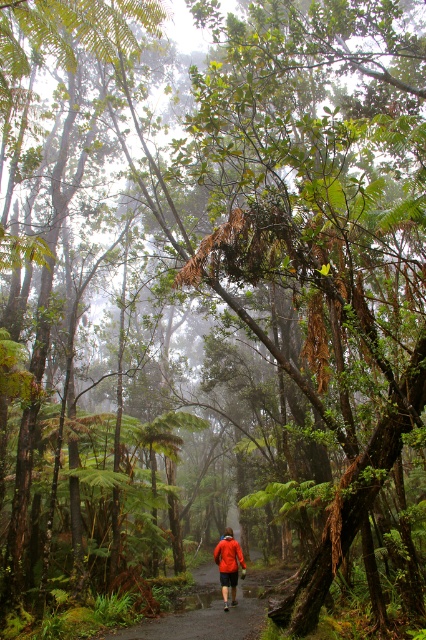
Who is taller, dark brown dirt path at center or red fabric jacket at center?

With more height is dark brown dirt path at center.

Between point (256, 589) and point (226, 572), which one is positioned in front?

Point (226, 572) is more forward.

Where is `dark brown dirt path at center`? The image size is (426, 640). dark brown dirt path at center is located at coordinates (207, 611).